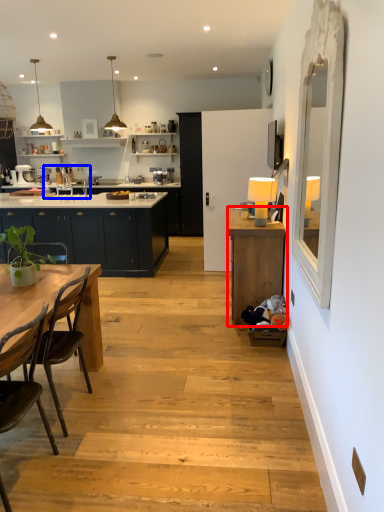
Question: Which object is further to the camera taking this photo, cabinetry (highlighted by a red box) or sink (highlighted by a blue box)?

Choices:
 (A) cabinetry
 (B) sink

Answer: (B)